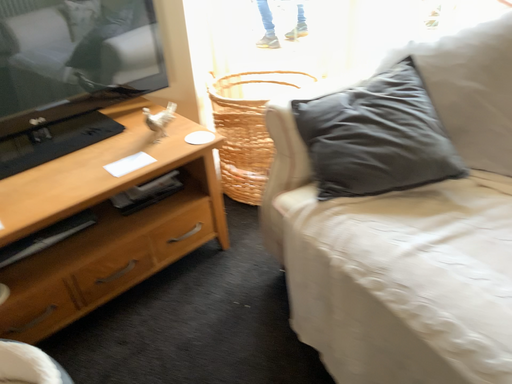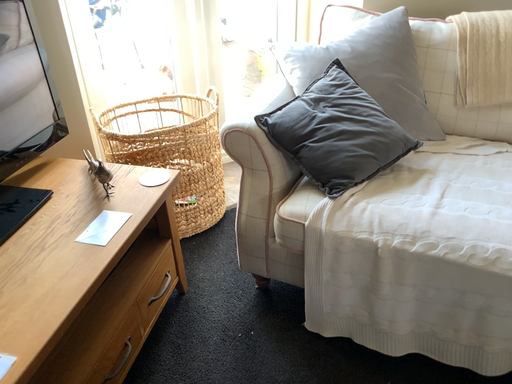
Question: Which way did the camera rotate in the video?

Choices:
 (A) rotated downward
 (B) rotated upward

Answer: (B)